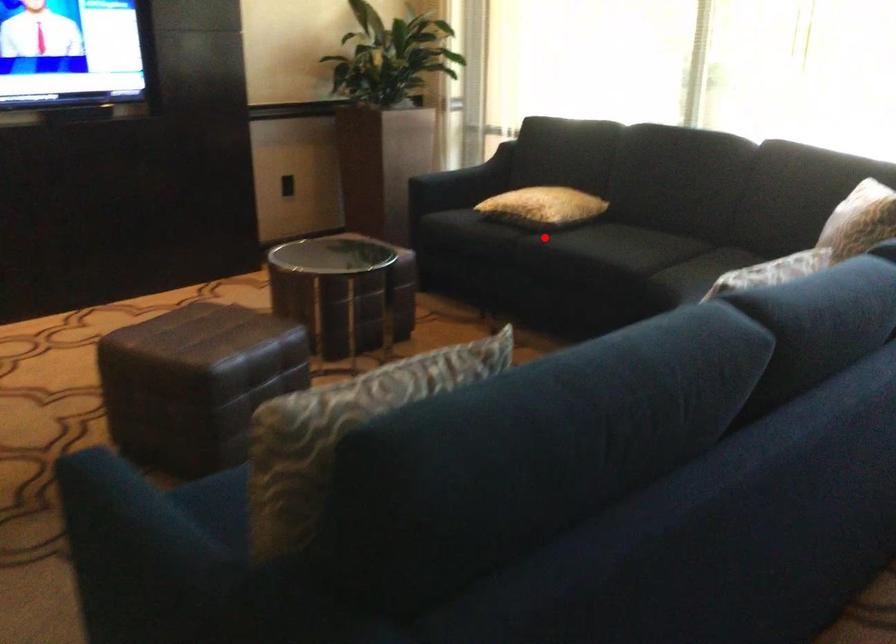
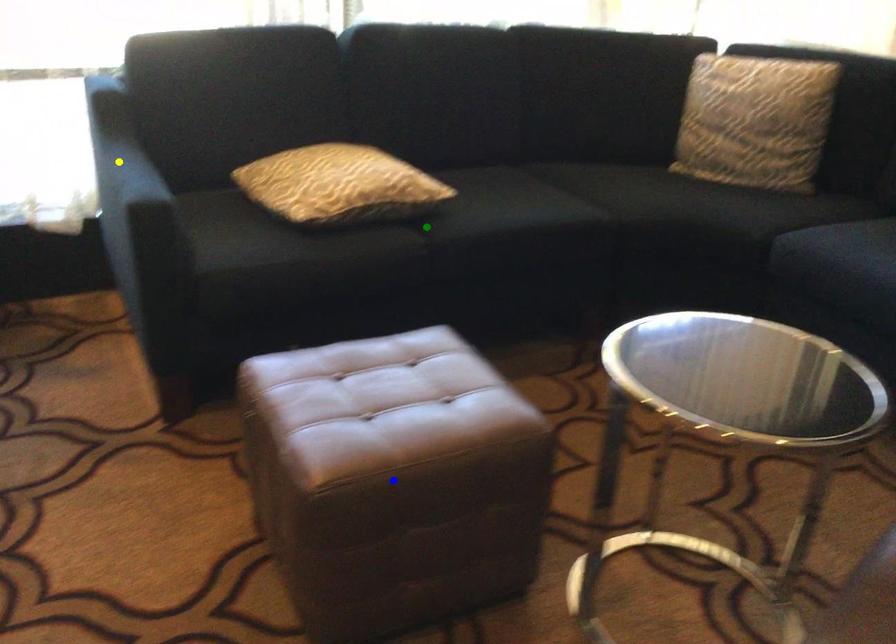
Question: I am providing you with two images of the same scene from different viewpoints. A red point is marked on the first image. You are given multiple points on the second image. Which spot in image 2 lines up with the point in image 1?

Choices:
 (A) blue point
 (B) yellow point
 (C) green point

Answer: (C)